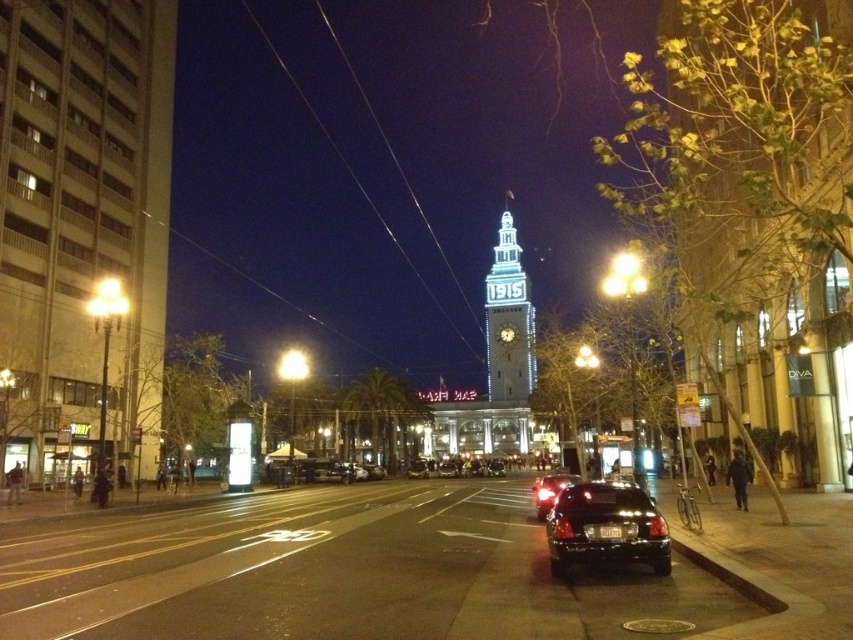
Who is positioned more to the right, satin black sedan at center or black glossy car at center?

satin black sedan at center

Between point (573, 502) and point (544, 477), which one is positioned behind?

Point (544, 477)

Find the location of a particular element. satin black sedan at center is located at coordinates (605, 525).

Based on the photo, can you confirm if black glossy car at center is taller than shiny black sedan at center?

Correct, black glossy car at center is much taller as shiny black sedan at center.

Who is more forward, (537, 493) or (334, 472)?

Point (537, 493) is in front.

In order to click on black glossy car at center in this screenshot , I will do `click(550, 492)`.

Based on the photo, which is more to the right, satin black sedan at center or illuminated glass clock tower at center?

satin black sedan at center

Does satin black sedan at center have a larger size compared to illuminated glass clock tower at center?

Actually, satin black sedan at center might be smaller than illuminated glass clock tower at center.

Does point (668, 550) lie behind point (502, 365)?

No, (668, 550) is in front of (502, 365).

This screenshot has width=853, height=640. What are the coordinates of `satin black sedan at center` in the screenshot? It's located at (605, 525).